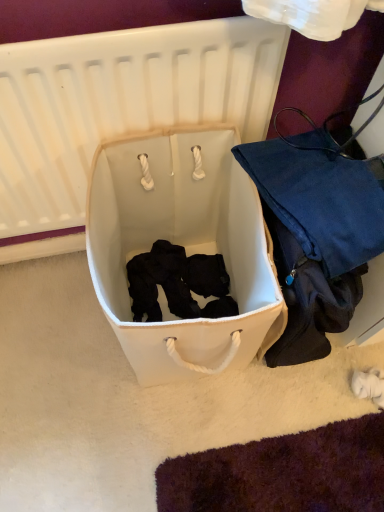
Identify the location of empty space that is ontop of white fabric infant bed at center (from a real-world perspective). This screenshot has width=384, height=512. (133, 22).